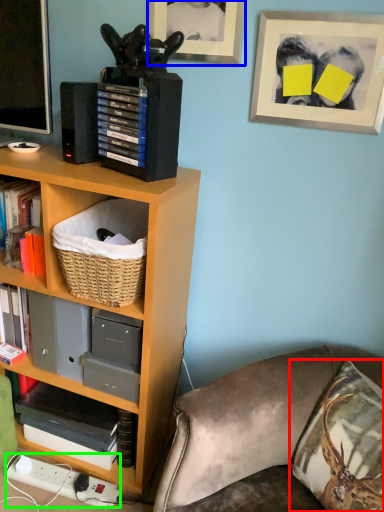
Question: Based on their relative distances, which object is farther from throw pillow (highlighted by a red box)? Choose from picture frame (highlighted by a blue box) and plug (highlighted by a green box).

Choices:
 (A) picture frame
 (B) plug

Answer: (A)